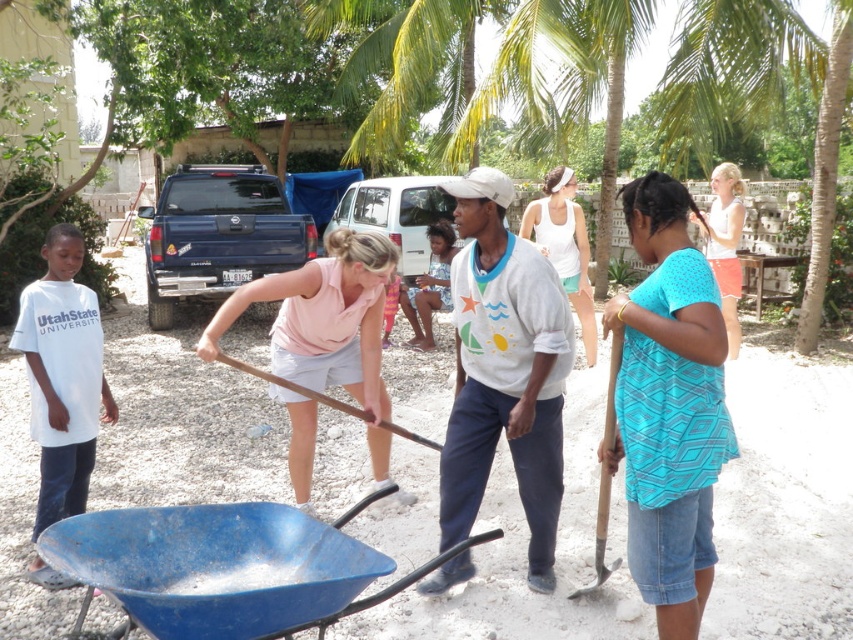
Question: Considering the real-world distances, which object is closest to the blue plastic cart at lower left?

Choices:
 (A) brown wooden shovel at center
 (B) white tank top at center
 (C) pink fabric shirt at center
 (D) white cotton sweater at center

Answer: (D)

Question: Which point is farther to the camera?

Choices:
 (A) white cotton shirt at left
 (B) white tank top at center

Answer: (B)

Question: Is white cotton sweater at center to the right of white tank top at center from the viewer's perspective?

Choices:
 (A) yes
 (B) no

Answer: (B)

Question: Can you confirm if blue plastic cart at lower left is positioned to the right of white tank top at center?

Choices:
 (A) yes
 (B) no

Answer: (B)

Question: Which object is farther from the camera taking this photo?

Choices:
 (A) white tank top at upper right
 (B) pink fabric shirt at center

Answer: (A)

Question: Does white cotton sweater at center have a greater width compared to white cotton shirt at left?

Choices:
 (A) no
 (B) yes

Answer: (B)